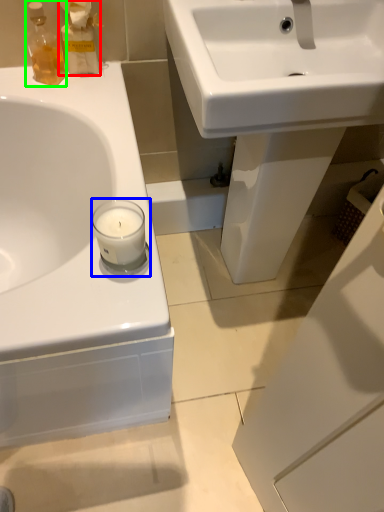
Question: Which is nearer to the cleaning product (highlighted by a red box)? candle holder (highlighted by a blue box) or toiletry (highlighted by a green box).

Choices:
 (A) candle holder
 (B) toiletry

Answer: (B)